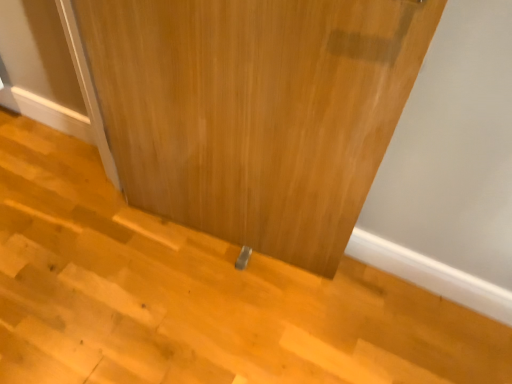
Question: From the image's perspective, relative to wooden at lower center, is wooden door at center above or below?

Choices:
 (A) above
 (B) below

Answer: (A)

Question: In the image, is wooden door at center on the left side or the right side of wooden at lower center?

Choices:
 (A) right
 (B) left

Answer: (B)

Question: Is point (283, 8) positioned closer to the camera than point (74, 173)?

Choices:
 (A) farther
 (B) closer

Answer: (B)

Question: From the image's perspective, relative to wooden door at center, is wooden at lower center above or below?

Choices:
 (A) above
 (B) below

Answer: (B)

Question: From a real-world perspective, is wooden at lower center positioned above or below wooden door at center?

Choices:
 (A) above
 (B) below

Answer: (B)

Question: Would you say wooden at lower center is to the left or to the right of wooden door at center in the picture?

Choices:
 (A) left
 (B) right

Answer: (B)

Question: In terms of height, does wooden at lower center look taller or shorter compared to wooden door at center?

Choices:
 (A) tall
 (B) short

Answer: (B)